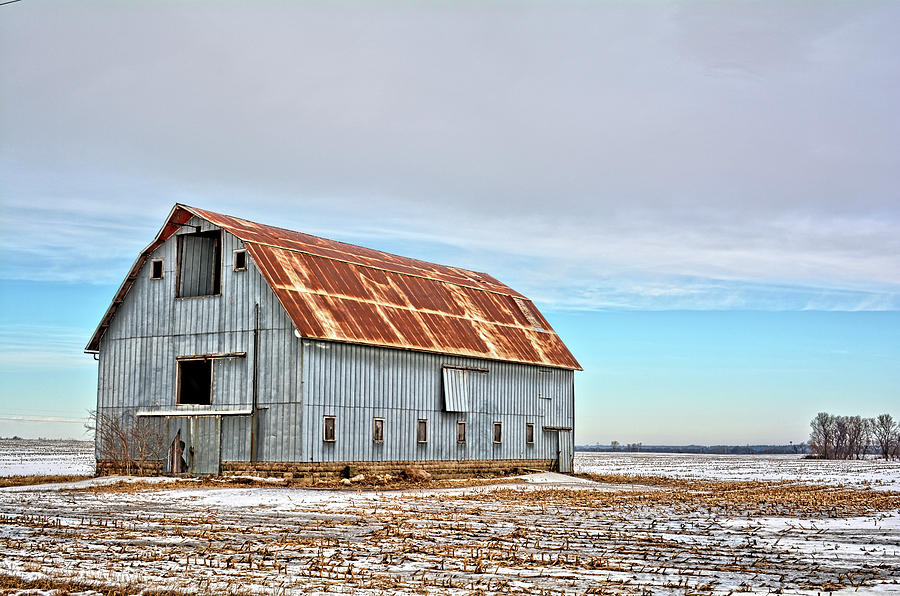
This screenshot has width=900, height=596. I want to click on top floor windows, so click(x=153, y=268), click(x=236, y=259).